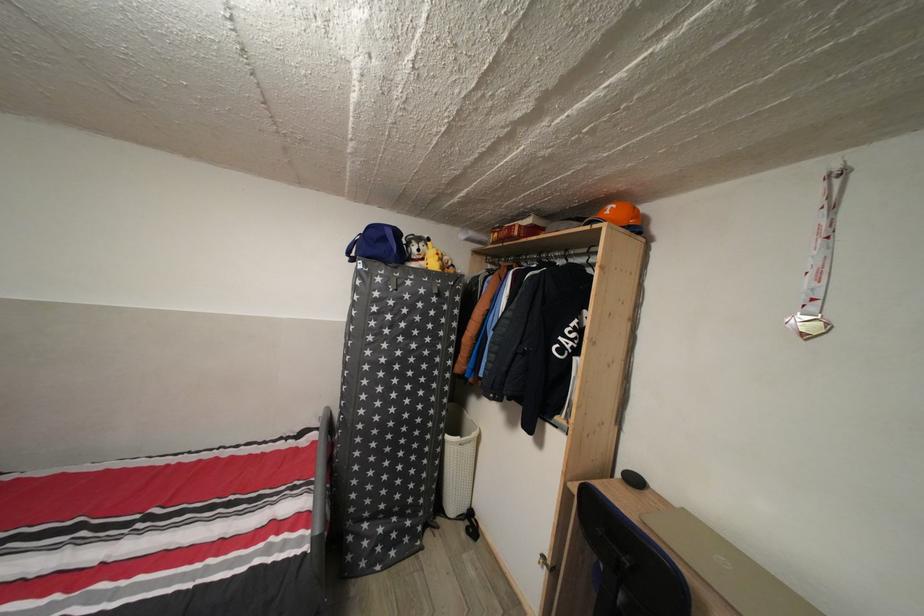
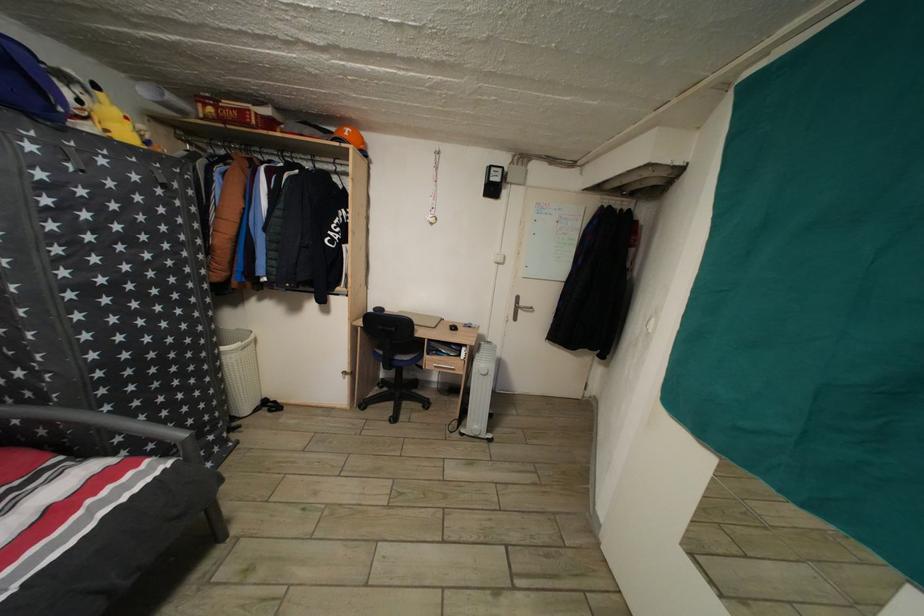
Locate, in the second image, the point that corresponds to the point at 278,545 in the first image.

(96, 508)